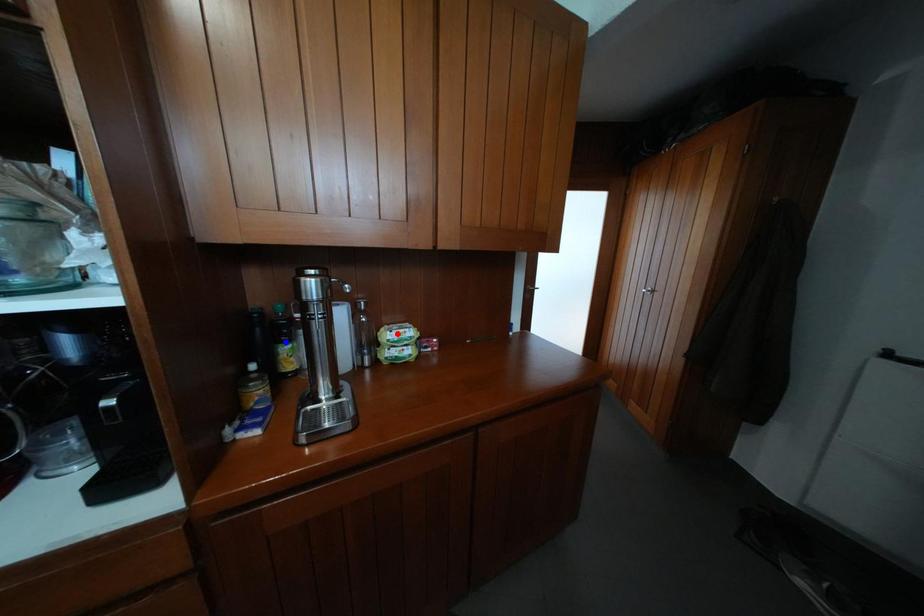
Question: Which of the two points in the image is closer to the camera?

Choices:
 (A) Blue point is closer.
 (B) Red point is closer.

Answer: (A)